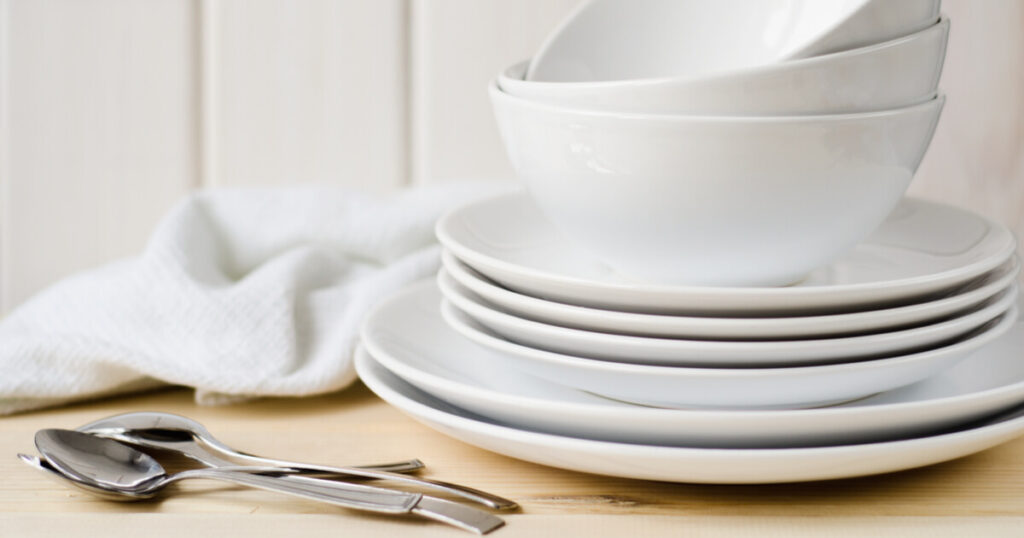
This screenshot has width=1024, height=538. Identify the location of spoons. (407, 460), (442, 485), (436, 507), (370, 502).